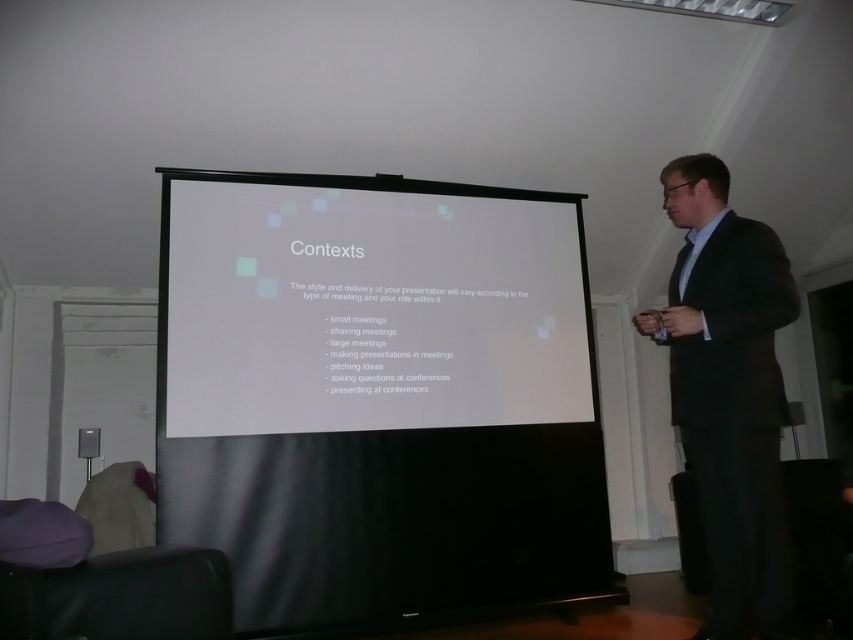
Question: Where is white matte projection screen at center located in relation to black suit at right in the image?

Choices:
 (A) above
 (B) below

Answer: (A)

Question: Does white matte projection screen at center lie in front of black suit at right?

Choices:
 (A) no
 (B) yes

Answer: (A)

Question: Which of the following is the closest to the observer?

Choices:
 (A) (172, 193)
 (B) (705, 465)

Answer: (B)

Question: Among these objects, which one is nearest to the camera?

Choices:
 (A) white matte projection screen at center
 (B) black suit at right

Answer: (B)

Question: Is white matte projection screen at center further to camera compared to black suit at right?

Choices:
 (A) no
 (B) yes

Answer: (B)